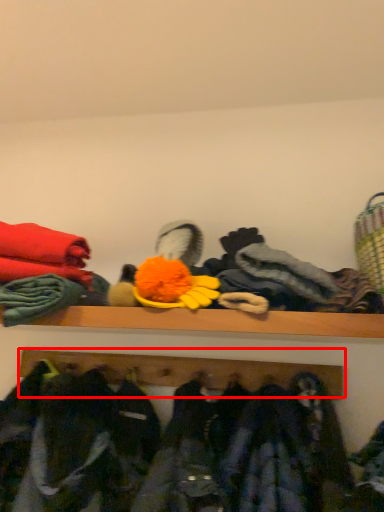
Question: From the image's perspective, what is the correct spatial positioning of shelf (annotated by the red box) in reference to clothing?

Choices:
 (A) below
 (B) above

Answer: (B)